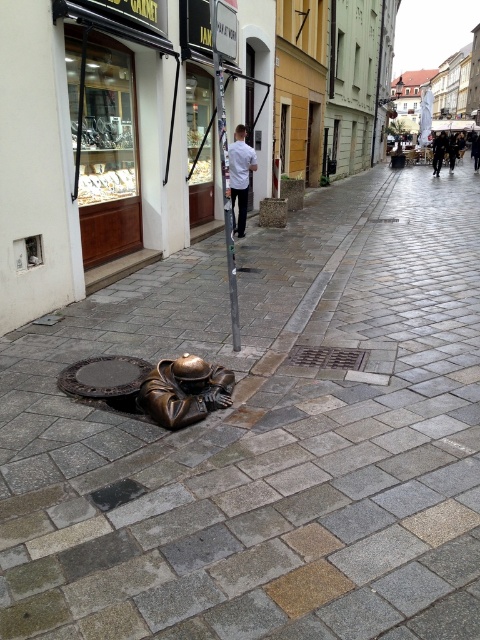
Question: Which of the following is the farthest from the observer?

Choices:
 (A) (434, 148)
 (B) (230, 160)
 (C) (230, 204)

Answer: (A)

Question: Which point is farther to the camera?

Choices:
 (A) (235, 282)
 (B) (447, 145)
 (C) (237, 157)

Answer: (B)

Question: Can you confirm if bronze statue at lower center is bigger than white matte shirt at center?

Choices:
 (A) no
 (B) yes

Answer: (A)

Question: Does bronze statue at lower center have a lesser width compared to dark gray metallic manhole cover at lower left?

Choices:
 (A) no
 (B) yes

Answer: (A)

Question: Estimate the real-world distances between objects in this image. Which object is closer to the white matte shirt at center?

Choices:
 (A) bronze statue at lower center
 (B) dark gray metallic manhole cover at lower left
 (C) dark gray fabric coat at upper right
 (D) silver metallic pole at center

Answer: (D)

Question: Can you confirm if silver metallic pole at center is positioned to the left of white matte shirt at center?

Choices:
 (A) yes
 (B) no

Answer: (A)